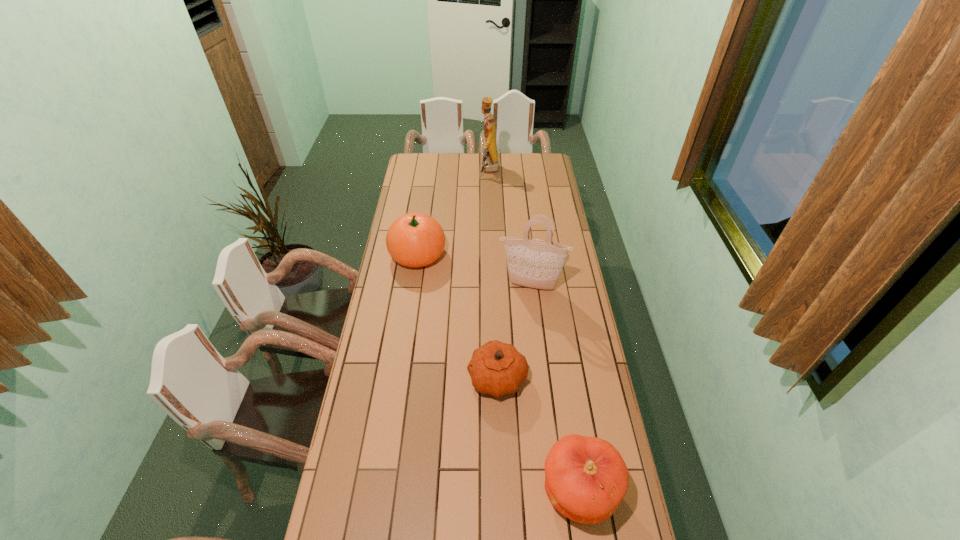
This screenshot has height=540, width=960. I want to click on pumpkin that can be found as the closest to the nearest object, so click(x=496, y=368).

Choose which pumpkin is the third nearest neighbor to the third farthest object. Please provide its 2D coordinates. Your answer should be formatted as a tuple, i.e. [(x, y)], where the tuple contains the x and y coordinates of a point satisfying the conditions above.

[(586, 478)]

Identify the location of free space that satisfies the following two spatial constraints: 1. on the back side of the rightmost pumpkin; 2. on the front-facing side of the nutcracker. The width and height of the screenshot is (960, 540). (531, 171).

Identify the location of vacant area in the image that satisfies the following two spatial constraints: 1. on the front-facing side of the second pumpkin from right to left; 2. on the right side of the nearest object. This screenshot has width=960, height=540. (501, 491).

Find the location of a particular element. The width and height of the screenshot is (960, 540). vacant space that satisfies the following two spatial constraints: 1. on the front side of the shopping bag; 2. on the front-facing side of the fourth farthest object is located at coordinates (541, 378).

Find the location of a particular element. Image resolution: width=960 pixels, height=540 pixels. vacant area that satisfies the following two spatial constraints: 1. on the front-facing side of the nutcracker; 2. on the left side of the shopping bag is located at coordinates (492, 286).

At what (x,y) coordinates should I click in order to perform the action: click on free space that satisfies the following two spatial constraints: 1. on the front-facing side of the farthest object; 2. on the front side of the fourth nearest object. Please return your answer as a coordinate pair (x, y). The image size is (960, 540). Looking at the image, I should click on (492, 255).

Where is `vacant area that satisfies the following two spatial constraints: 1. on the front-facing side of the nutcracker; 2. on the left side of the third nearest object`? vacant area that satisfies the following two spatial constraints: 1. on the front-facing side of the nutcracker; 2. on the left side of the third nearest object is located at coordinates (492, 286).

You are a GUI agent. You are given a task and a screenshot of the screen. Output one action in this format:
    pyautogui.click(x=<x>, y=<y>)
    Task: Click on the free point that satisfies the following two spatial constraints: 1. on the front-facing side of the farthest object; 2. on the left side of the third farthest object
    
    Given the screenshot: What is the action you would take?
    pyautogui.click(x=492, y=286)